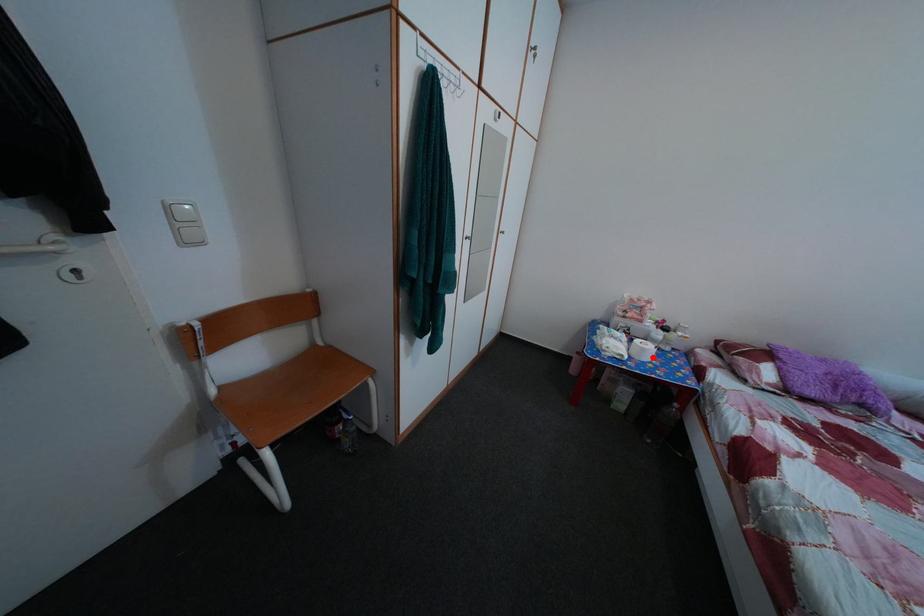
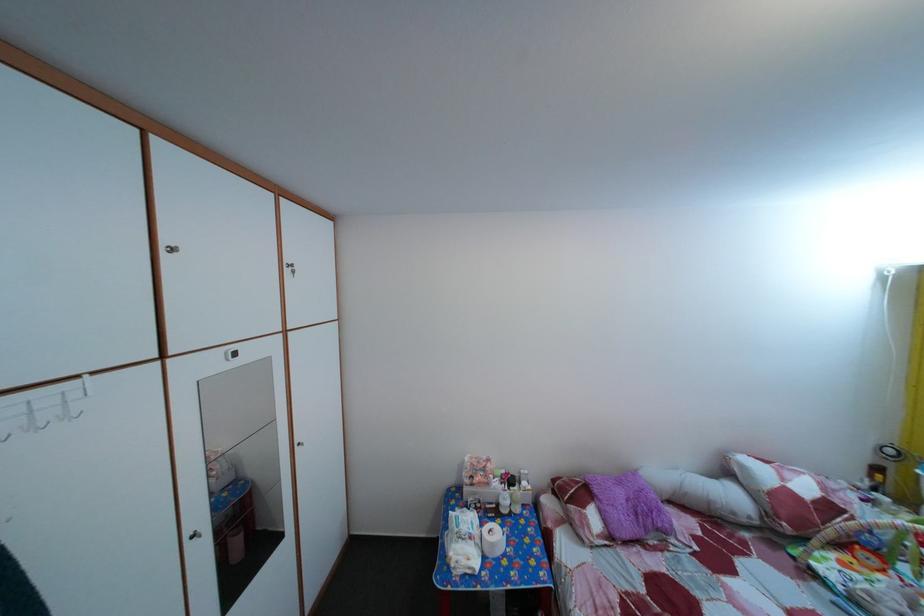
In the second image, find the point that corresponds to the highlighted location in the first image.

(502, 553)